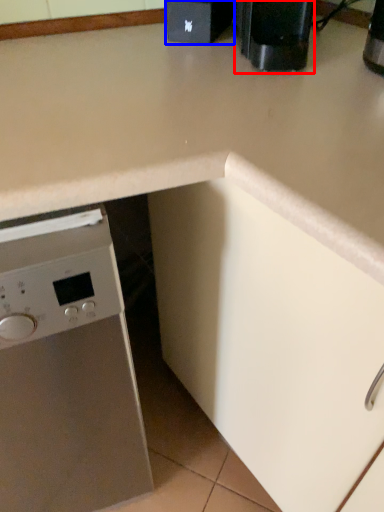
Question: Which object appears farthest to the camera in this image, coffee machine (highlighted by a red box) or appliance (highlighted by a blue box)?

Choices:
 (A) coffee machine
 (B) appliance

Answer: (B)